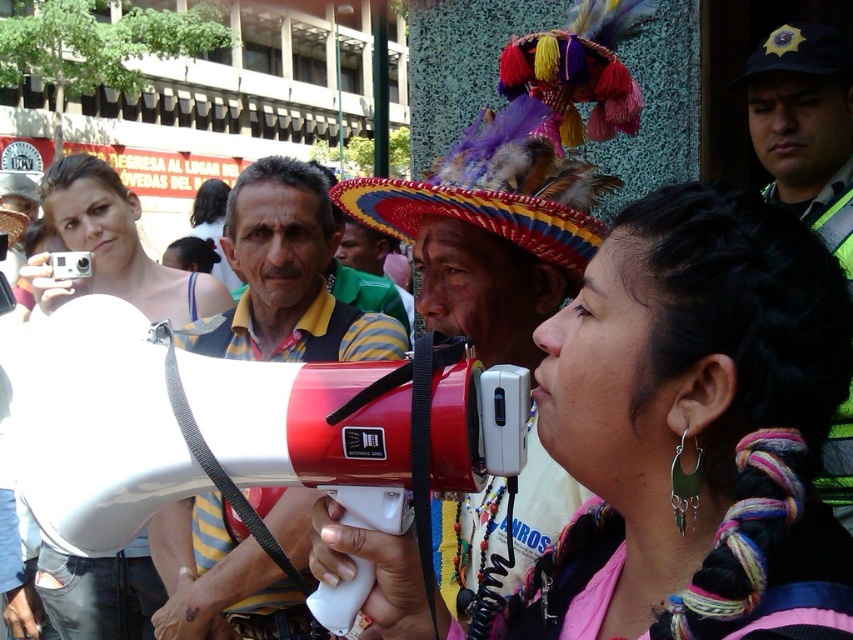
Question: Which point appears farthest from the camera in this image?

Choices:
 (A) pyautogui.click(x=592, y=630)
 (B) pyautogui.click(x=189, y=625)

Answer: (B)

Question: Is matte black megaphone at center above reflective silver helmet at upper right?

Choices:
 (A) yes
 (B) no

Answer: (B)

Question: Which point appears farthest from the camera in this image?

Choices:
 (A) (798, 252)
 (B) (827, 156)
 (C) (503, 157)

Answer: (B)

Question: Which object is the farthest from the matte black megaphone at center?

Choices:
 (A) red plastic megaphone at center
 (B) matte white megaphone at center

Answer: (B)

Question: Does multicolored feathered hat at center lie behind reflective silver helmet at upper right?

Choices:
 (A) no
 (B) yes

Answer: (B)

Question: Does matte black megaphone at center have a larger size compared to multicolored feathered hat at center?

Choices:
 (A) no
 (B) yes

Answer: (B)